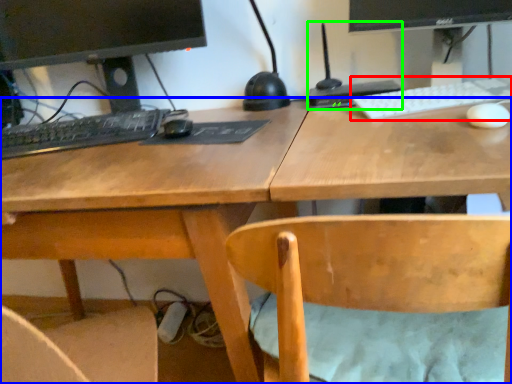
Question: Based on their relative distances, which object is nearer to computer keyboard (highlighted by a red box)? Choose from desk (highlighted by a blue box) and computer (highlighted by a green box).

Choices:
 (A) desk
 (B) computer

Answer: (B)